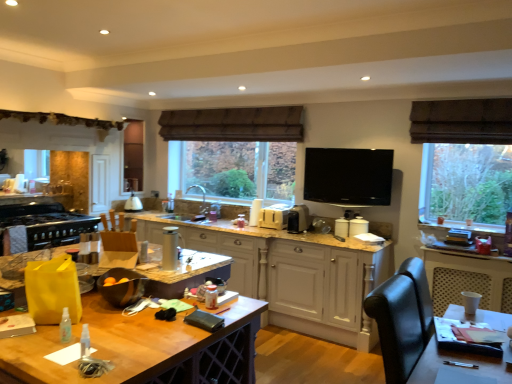
Where is `matte white lampshade at center, positioned as the 2th appliance in left-to-right order`? matte white lampshade at center, positioned as the 2th appliance in left-to-right order is located at coordinates (133, 203).

The width and height of the screenshot is (512, 384). I want to click on wooden table at center, so click(143, 347).

The height and width of the screenshot is (384, 512). Describe the element at coordinates (143, 347) in the screenshot. I see `wooden table at center` at that location.

The image size is (512, 384). Describe the element at coordinates (274, 216) in the screenshot. I see `white plastic toaster at center, which is the third appliance in right-to-left order` at that location.

Describe the element at coordinates (47, 223) in the screenshot. This screenshot has width=512, height=384. I see `black matte stove at left, the 5th appliance from the back` at that location.

Identify the location of satin silver toaster at center, the fifth appliance positioned from the left. (298, 219).

At what (x,y) coordinates should I click in order to perform the action: click on silver metallic thermos at center, the 6th appliance viewed from the back. Please return your answer as a coordinate pair (x, y). This screenshot has height=384, width=512. Looking at the image, I should click on (170, 248).

Would you say flat screen tv at upper center, the 4th appliance in the back-to-front sequence, contains satin silver toaster at center, marked as the second appliance in a right-to-left arrangement?

No.

Considering the sizes of objects flat screen tv at upper center, the 4th appliance in the back-to-front sequence, and satin silver toaster at center, which appears as the 3th appliance when viewed from the back, in the image provided, who is thinner, flat screen tv at upper center, the 4th appliance in the back-to-front sequence, or satin silver toaster at center, which appears as the 3th appliance when viewed from the back,?

With smaller width is flat screen tv at upper center, the 4th appliance in the back-to-front sequence.

How distant is flat screen tv at upper center, which ranks as the first appliance in right-to-left order, from satin silver toaster at center, marked as the second appliance in a right-to-left arrangement?

A distance of 23.94 inches exists between flat screen tv at upper center, which ranks as the first appliance in right-to-left order, and satin silver toaster at center, marked as the second appliance in a right-to-left arrangement.

Can you confirm if white plastic toaster at center, marked as the fifth appliance in a front-to-back arrangement, is smaller than matte white lampshade at center, positioned as the first appliance in back-to-front order?

Correct, white plastic toaster at center, marked as the fifth appliance in a front-to-back arrangement, occupies less space than matte white lampshade at center, positioned as the first appliance in back-to-front order.

Considering the relative sizes of white plastic toaster at center, positioned as the 4th appliance in left-to-right order, and matte white lampshade at center, positioned as the first appliance in back-to-front order, in the image provided, is white plastic toaster at center, positioned as the 4th appliance in left-to-right order, wider than matte white lampshade at center, positioned as the first appliance in back-to-front order,?

No.

In the image, is white plastic toaster at center, marked as the fifth appliance in a front-to-back arrangement, positioned in front of or behind matte white lampshade at center, the fifth appliance viewed from the right?

Visually, white plastic toaster at center, marked as the fifth appliance in a front-to-back arrangement, is located in front of matte white lampshade at center, the fifth appliance viewed from the right.

Is white plastic toaster at center, positioned as the 4th appliance in left-to-right order, not inside matte white lampshade at center, the fifth appliance viewed from the right?

Absolutely, white plastic toaster at center, positioned as the 4th appliance in left-to-right order, is external to matte white lampshade at center, the fifth appliance viewed from the right.

Is flat screen tv at upper center, which ranks as the first appliance in right-to-left order, far away from white plastic toaster at center, which is the third appliance in right-to-left order?

No, there isn't a large distance between flat screen tv at upper center, which ranks as the first appliance in right-to-left order, and white plastic toaster at center, which is the third appliance in right-to-left order.

Is flat screen tv at upper center, marked as the sixth appliance in a left-to-right arrangement, taller than white plastic toaster at center, marked as the fifth appliance in a front-to-back arrangement?

Indeed, flat screen tv at upper center, marked as the sixth appliance in a left-to-right arrangement, has a greater height compared to white plastic toaster at center, marked as the fifth appliance in a front-to-back arrangement.

Is silver metallic thermos at center, the 6th appliance viewed from the back, outside of satin silver toaster at center, marked as the second appliance in a right-to-left arrangement?

Yes.

Is silver metallic thermos at center, placed as the 4th appliance when sorted from right to left, touching satin silver toaster at center, marked as the second appliance in a right-to-left arrangement?

No, silver metallic thermos at center, placed as the 4th appliance when sorted from right to left, is not in contact with satin silver toaster at center, marked as the second appliance in a right-to-left arrangement.

How far apart are silver metallic thermos at center, the third appliance from the left, and satin silver toaster at center, the fifth appliance positioned from the left?

A distance of 5.60 feet exists between silver metallic thermos at center, the third appliance from the left, and satin silver toaster at center, the fifth appliance positioned from the left.

Based on their positions, is silver metallic thermos at center, the 6th appliance viewed from the back, located to the left or right of satin silver toaster at center, the fifth appliance positioned from the left?

silver metallic thermos at center, the 6th appliance viewed from the back, is positioned on satin silver toaster at center, the fifth appliance positioned from the left,'s left side.

Considering the sizes of white painted wood cabinetry at center and black matte stove at left, the second appliance from the front, in the image, is white painted wood cabinetry at center wider or thinner than black matte stove at left, the second appliance from the front,?

white painted wood cabinetry at center is thinner than black matte stove at left, the second appliance from the front.

Does point (318, 301) appear closer or farther from the camera than point (65, 240)?

Point (318, 301) is positioned closer to the camera compared to point (65, 240).

Does white painted wood cabinetry at center lie behind black matte stove at left, the second appliance from the front?

No, white painted wood cabinetry at center is closer to the viewer.

Would you say black matte stove at left, the 5th appliance from the back, is part of white painted wood cabinetry at center's contents?

No, black matte stove at left, the 5th appliance from the back, is not surrounded by white painted wood cabinetry at center.

Is satin silver toaster at center, marked as the second appliance in a right-to-left arrangement, facing towards black matte stove at left, the second appliance from the front?

No.

Based on the photo, considering the relative positions of satin silver toaster at center, the fourth appliance positioned from the front, and black matte stove at left, positioned as the first appliance in left-to-right order, in the image provided, is satin silver toaster at center, the fourth appliance positioned from the front, in front of black matte stove at left, positioned as the first appliance in left-to-right order,?

No, satin silver toaster at center, the fourth appliance positioned from the front, is further to the viewer.

Is satin silver toaster at center, marked as the second appliance in a right-to-left arrangement, shorter than black matte stove at left, positioned as the sixth appliance in right-to-left order?

No, satin silver toaster at center, marked as the second appliance in a right-to-left arrangement, is not shorter than black matte stove at left, positioned as the sixth appliance in right-to-left order.

Visually, is white painted wood cabinetry at center positioned to the left or to the right of brown fabric exhaust hood at upper center?

white painted wood cabinetry at center is positioned on brown fabric exhaust hood at upper center's right side.

Measure the distance between white painted wood cabinetry at center and brown fabric exhaust hood at upper center.

white painted wood cabinetry at center is 4.34 feet from brown fabric exhaust hood at upper center.

Is white painted wood cabinetry at center beside brown fabric exhaust hood at upper center?

white painted wood cabinetry at center and brown fabric exhaust hood at upper center are clearly separated.

Is white painted wood cabinetry at center in front of or behind brown fabric exhaust hood at upper center in the image?

white painted wood cabinetry at center is in front of brown fabric exhaust hood at upper center.

Where is `appliance that is the 1st one below the flat screen tv at upper center, marked as the sixth appliance in a left-to-right arrangement (from a real-world perspective)`? This screenshot has height=384, width=512. appliance that is the 1st one below the flat screen tv at upper center, marked as the sixth appliance in a left-to-right arrangement (from a real-world perspective) is located at coordinates (298, 219).

You are a GUI agent. You are given a task and a screenshot of the screen. Output one action in this format:
    pyautogui.click(x=<x>, y=<y>)
    Task: Click on the appliance that is the 2nd one when counting leftward from the white plastic toaster at center, marked as the fifth appliance in a front-to-back arrangement
    The width and height of the screenshot is (512, 384).
    Given the screenshot: What is the action you would take?
    coord(133,203)

Consider the image. Which object lies nearer to the anchor point matte white lampshade at center, the fifth appliance viewed from the right, white plastic toaster at center, which is the third appliance in right-to-left order, or silver metallic thermos at center, the third appliance from the left?

The object closer to matte white lampshade at center, the fifth appliance viewed from the right, is white plastic toaster at center, which is the third appliance in right-to-left order.

From the image, which object appears to be nearer to wooden table at center, brown fabric exhaust hood at upper center or flat screen tv at upper center, which ranks as the first appliance in right-to-left order?

flat screen tv at upper center, which ranks as the first appliance in right-to-left order, is closer to wooden table at center.

Which object lies further to the anchor point wooden table at center, flat screen tv at upper center, the 4th appliance in the back-to-front sequence, or black matte stove at left, positioned as the sixth appliance in right-to-left order?

Based on the image, black matte stove at left, positioned as the sixth appliance in right-to-left order, appears to be further to wooden table at center.

Based on their spatial positions, is black matte stove at left, the 5th appliance from the back, or white plastic toaster at center, placed as the 2th appliance when sorted from back to front, closer to flat screen tv at upper center, the 4th appliance in the back-to-front sequence?

Among the two, white plastic toaster at center, placed as the 2th appliance when sorted from back to front, is located nearer to flat screen tv at upper center, the 4th appliance in the back-to-front sequence.

From the image, which object appears to be farther from silver metallic thermos at center, placed as the 4th appliance when sorted from right to left, white painted wood cabinetry at center or flat screen tv at upper center, which ranks as the first appliance in right-to-left order?

Among the two, flat screen tv at upper center, which ranks as the first appliance in right-to-left order, is located further to silver metallic thermos at center, placed as the 4th appliance when sorted from right to left.

Considering their positions, is black matte stove at left, the 5th appliance from the back, positioned closer to brown fabric exhaust hood at upper center than wooden table at center?

black matte stove at left, the 5th appliance from the back, is positioned closer to the anchor brown fabric exhaust hood at upper center.

Which object lies nearer to the anchor point flat screen tv at upper center, which ranks as the 3th appliance in front-to-back order, white plastic toaster at center, placed as the 2th appliance when sorted from back to front, or matte white lampshade at center, positioned as the 2th appliance in left-to-right order?

The object closer to flat screen tv at upper center, which ranks as the 3th appliance in front-to-back order, is white plastic toaster at center, placed as the 2th appliance when sorted from back to front.

From the image, which object appears to be farther from matte white lampshade at center, positioned as the 6th appliance in front-to-back order, black matte stove at left, positioned as the first appliance in left-to-right order, or brown fabric exhaust hood at upper center?

Among the two, brown fabric exhaust hood at upper center is located further to matte white lampshade at center, positioned as the 6th appliance in front-to-back order.

Locate an element on the screen. cabinetry located between wooden table at center and brown fabric exhaust hood at upper center in the depth direction is located at coordinates (292, 274).

Where is `cabinetry situated between matte white lampshade at center, positioned as the first appliance in back-to-front order, and flat screen tv at upper center, which ranks as the 3th appliance in front-to-back order, from left to right`? cabinetry situated between matte white lampshade at center, positioned as the first appliance in back-to-front order, and flat screen tv at upper center, which ranks as the 3th appliance in front-to-back order, from left to right is located at coordinates (292, 274).

Identify the location of exhaust hood situated between matte white lampshade at center, positioned as the first appliance in back-to-front order, and flat screen tv at upper center, the 4th appliance in the back-to-front sequence, from left to right. Image resolution: width=512 pixels, height=384 pixels. (233, 124).

I want to click on exhaust hood located between white painted wood cabinetry at center and matte white lampshade at center, the fifth appliance viewed from the right, in the depth direction, so click(x=233, y=124).